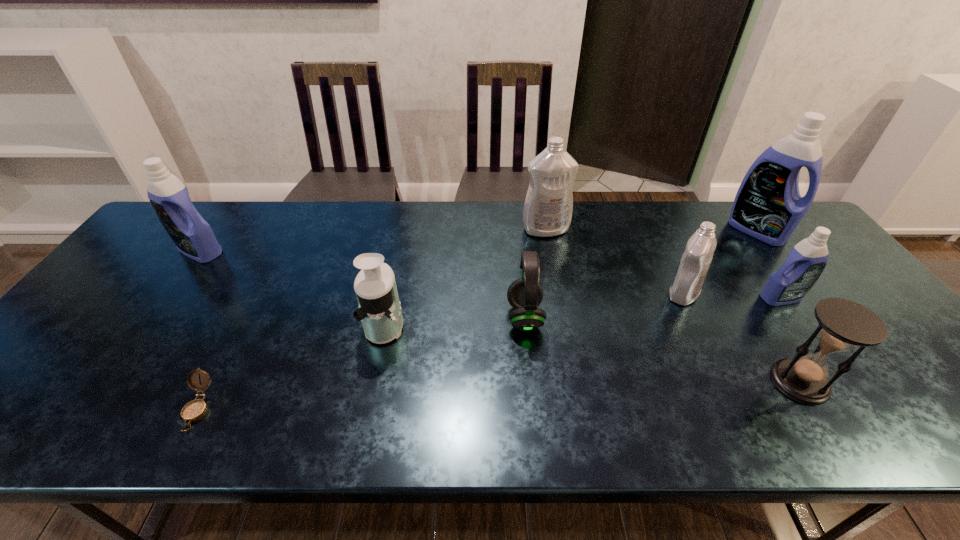
At what (x,y) coordinates should I click in order to perform the action: click on vacant position located 0.130m on the right of the hourglass. Please return your answer as a coordinate pair (x, y). Looking at the image, I should click on (884, 382).

The height and width of the screenshot is (540, 960). Identify the location of vacant space situated 0.260m on the ear cups of the headset. (405, 317).

This screenshot has width=960, height=540. Find the location of `free space located on the ear cups of the headset`. free space located on the ear cups of the headset is located at coordinates (444, 317).

At what (x,y) coordinates should I click in order to perform the action: click on vacant region located 0.340m on the ear cups of the headset. Please return your answer as a coordinate pair (x, y). This screenshot has height=540, width=960. Looking at the image, I should click on [373, 317].

Locate an element on the screen. The image size is (960, 540). hourglass that is positioned at the near edge is located at coordinates (843, 324).

Locate an element on the screen. compass situated at the near edge is located at coordinates (194, 410).

Where is `object present at the left edge`? Image resolution: width=960 pixels, height=540 pixels. object present at the left edge is located at coordinates (192, 235).

What are the coordinates of `object that is at the far left corner` in the screenshot? It's located at (192, 235).

The image size is (960, 540). In order to click on object located at the far right corner in this screenshot , I will do `click(768, 206)`.

The width and height of the screenshot is (960, 540). What are the coordinates of `vacant space at the far edge` in the screenshot? It's located at (520, 230).